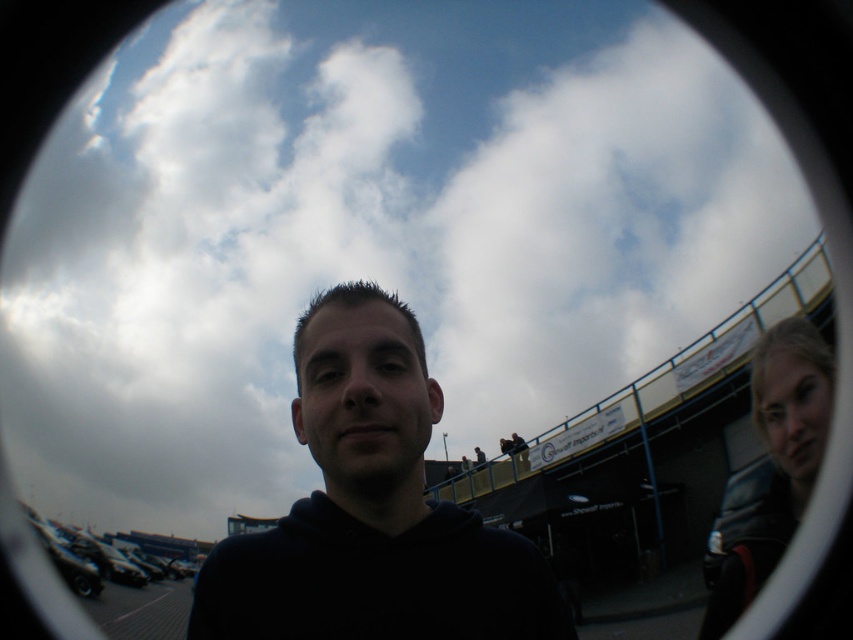
Question: Is black matte hoodie at center further to camera compared to dark gray leather jacket at right?

Choices:
 (A) no
 (B) yes

Answer: (A)

Question: Does black matte hoodie at center have a greater width compared to dark gray leather jacket at right?

Choices:
 (A) yes
 (B) no

Answer: (A)

Question: Does black matte hoodie at center appear under dark gray leather jacket at right?

Choices:
 (A) yes
 (B) no

Answer: (B)

Question: Which point appears closest to the camera in this image?

Choices:
 (A) (769, 429)
 (B) (477, 625)

Answer: (B)